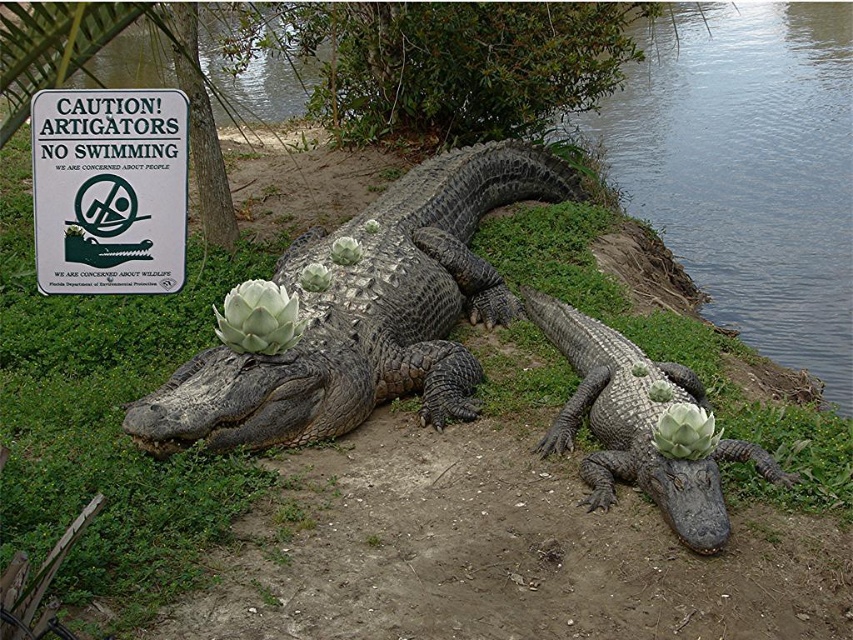
From the picture: You are a visitor at this location and want to read the warning sign. Which object should you look at first, the white paper sign at upper left or the matte gray crocodile at center?

The white paper sign at upper left is smaller in size compared to the matte gray crocodile at center, so you should look at the matte gray crocodile at center first because it is larger and more noticeable.

You are a park visitor who wants to place a 2.5 meter long kayak between the white paper sign at upper left and the matte gray crocodile at center. Is there enough space to fit the kayak between them?

The white paper sign at upper left is 2.43 meters from matte gray crocodile at center. Since the kayak is 2.5 meters long, there is not enough space to fit the kayak between them.

You are a visitor at the park and want to take a photo of the white paper sign at upper left without the dark gray textured crocodile at center blocking the view. Is it possible to position yourself in a way that the sign is visible but the crocodile is not in the frame?

The dark gray textured crocodile at center is further to the viewer than the white paper sign at upper left, so you can move behind the crocodile to take a photo where the sign is visible while the crocodile is out of frame.